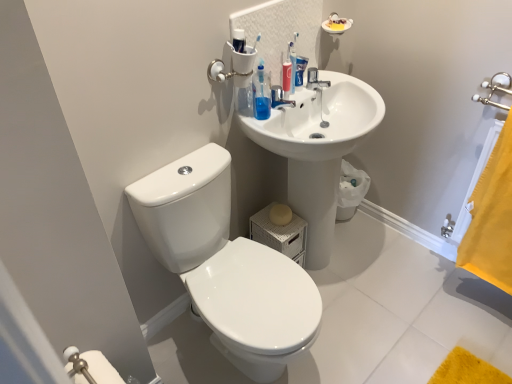
This screenshot has height=384, width=512. In order to click on spots to the right of white glossy sink at upper right in this screenshot , I will do `click(395, 269)`.